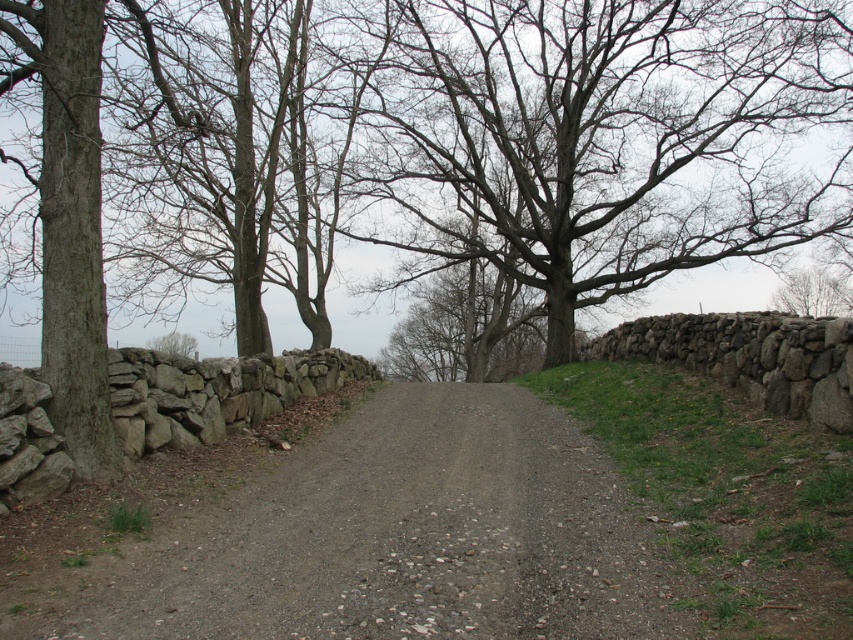
Question: Can you confirm if bare branches at center is positioned below gray gravel road at center?

Choices:
 (A) no
 (B) yes

Answer: (A)

Question: Does bare branches at center have a smaller size compared to gray gravel road at center?

Choices:
 (A) no
 (B) yes

Answer: (A)

Question: Does bare branches at center appear on the left side of gray gravel road at center?

Choices:
 (A) yes
 (B) no

Answer: (B)

Question: Which point is farther to the camera?

Choices:
 (A) bare branches at center
 (B) gray gravel road at center

Answer: (A)

Question: Which point appears closest to the camera in this image?

Choices:
 (A) (519, 518)
 (B) (604, 193)

Answer: (A)